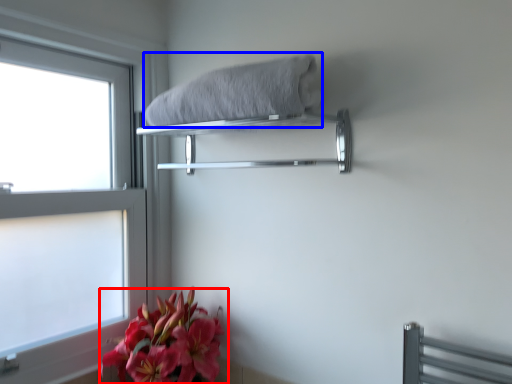
Question: Which object is further to the camera taking this photo, flower (highlighted by a red box) or bath towel (highlighted by a blue box)?

Choices:
 (A) flower
 (B) bath towel

Answer: (A)